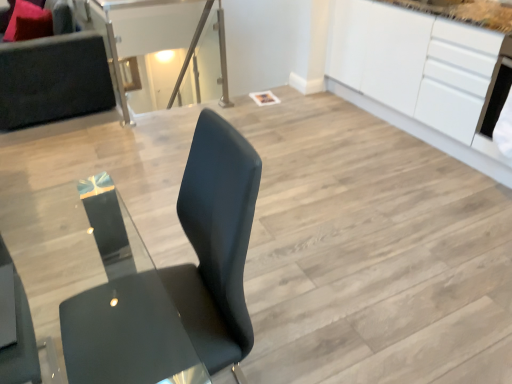
Question: Is velvet pink pillow at upper left inside or outside of matte black chair at lower left, the first chair in the top-to-bottom sequence?

Choices:
 (A) inside
 (B) outside

Answer: (B)

Question: Is velvet pink pillow at upper left bigger or smaller than matte black chair at lower left, the first chair in the top-to-bottom sequence?

Choices:
 (A) small
 (B) big

Answer: (B)

Question: Which object is the farthest from the matte black chair at lower left, the first chair in the top-to-bottom sequence?

Choices:
 (A) velvet pink pillow at upper left
 (B) dark gray fabric couch at upper left
 (C) white glossy cabinetry at upper right
 (D) transparent glass table at upper center
 (E) matte black chair at center, the 1th chair in the bottom-to-top sequence

Answer: (D)

Question: Estimate the real-world distances between objects in this image. Which object is closer to the transparent glass table at upper center?

Choices:
 (A) white glossy cabinetry at upper right
 (B) velvet pink pillow at upper left
 (C) dark gray fabric couch at upper left
 (D) matte black chair at center, the 1th chair in the bottom-to-top sequence
 (E) matte black chair at lower left, the second chair positioned from the bottom

Answer: (C)